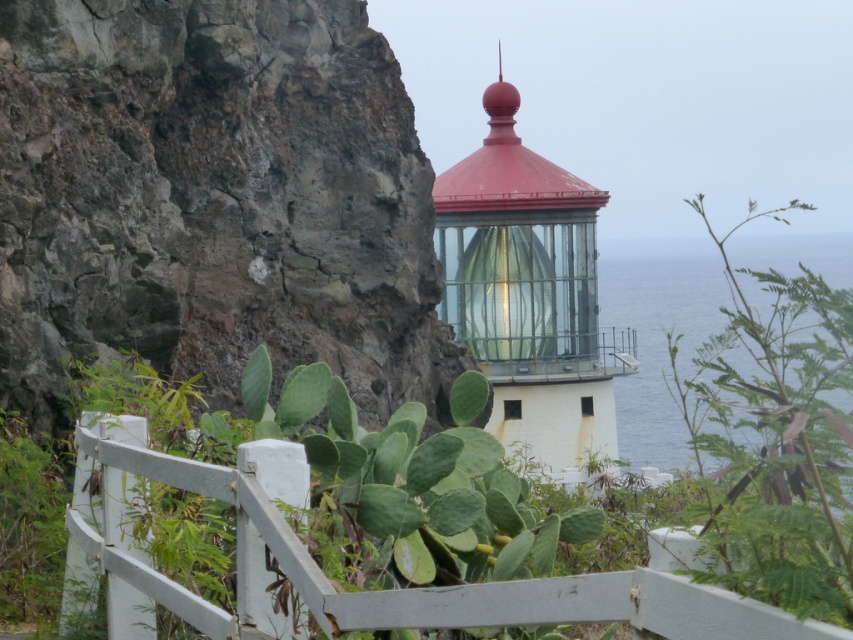
Question: Does green leafy plant at upper right come behind white wooden fence at center?

Choices:
 (A) yes
 (B) no

Answer: (A)

Question: Which is farther from the green leafy plant at upper right?

Choices:
 (A) green leafy cactus at lower left
 (B) white wooden fence at center

Answer: (A)

Question: Among these objects, which one is farthest from the camera?

Choices:
 (A) white wooden fence at center
 (B) green leafy plant at upper right
 (C) green leafy cactus at lower left

Answer: (C)

Question: Is green leafy plant at upper right positioned behind white wooden fence at center?

Choices:
 (A) no
 (B) yes

Answer: (B)

Question: Can you confirm if green leafy plant at upper right is positioned to the left of green leafy cactus at lower left?

Choices:
 (A) no
 (B) yes

Answer: (A)

Question: Estimate the real-world distances between objects in this image. Which object is closer to the green leafy plant at upper right?

Choices:
 (A) green leafy cactus at lower left
 (B) white wooden fence at center

Answer: (B)